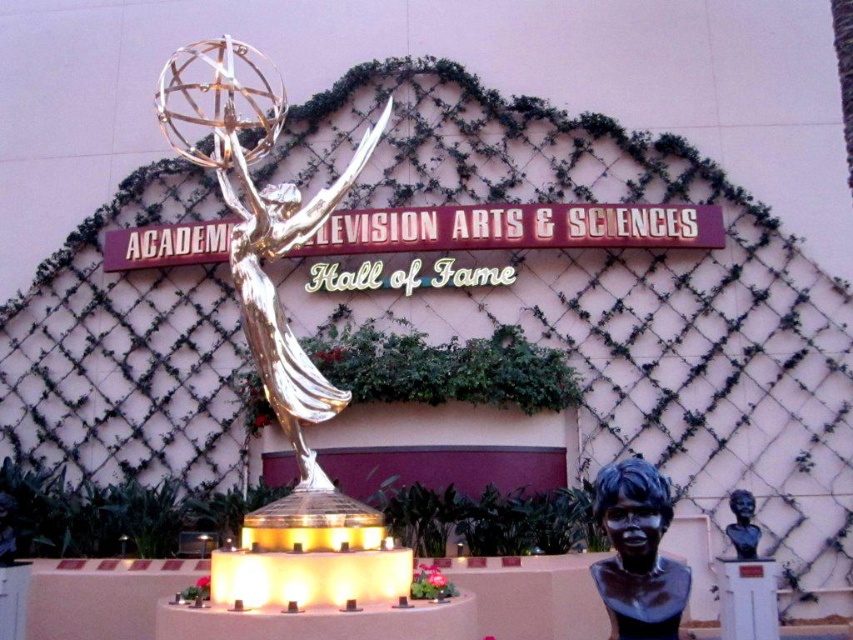
Question: Which object is closer to the camera taking this photo?

Choices:
 (A) gold metallic emmy statue at center
 (B) shiny silver bust at lower right

Answer: (B)

Question: Can you confirm if gold metallic emmy statue at center is thinner than shiny silver bust at lower right?

Choices:
 (A) no
 (B) yes

Answer: (A)

Question: Which of the following is the closest to the observer?

Choices:
 (A) (747, 528)
 (B) (604, 596)

Answer: (B)

Question: Does gold metallic emmy statue at center have a lesser width compared to shiny silver bust at lower right?

Choices:
 (A) no
 (B) yes

Answer: (A)

Question: Among these points, which one is nearest to the camera?

Choices:
 (A) (604, 486)
 (B) (735, 515)

Answer: (A)

Question: Does gold metallic emmy statue at center appear under shiny silver bust at lower right?

Choices:
 (A) yes
 (B) no

Answer: (B)